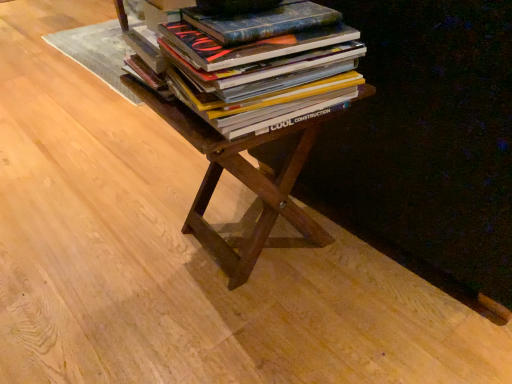
Locate an element on the screen. The width and height of the screenshot is (512, 384). vacant space situated on the left part of brown wood table at center is located at coordinates (97, 274).